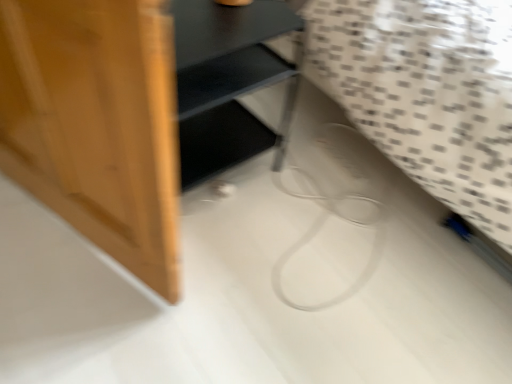
Question: Considering the relative sizes of white textured fabric at lower right and matte black shelf at center in the image provided, is white textured fabric at lower right taller than matte black shelf at center?

Choices:
 (A) yes
 (B) no

Answer: (A)

Question: From a real-world perspective, is white textured fabric at lower right on top of matte black shelf at center?

Choices:
 (A) no
 (B) yes

Answer: (B)

Question: Is matte black shelf at center inside white textured fabric at lower right?

Choices:
 (A) yes
 (B) no

Answer: (B)

Question: From the image's perspective, is white textured fabric at lower right located beneath matte black shelf at center?

Choices:
 (A) no
 (B) yes

Answer: (A)

Question: Can you confirm if white textured fabric at lower right is thinner than matte black shelf at center?

Choices:
 (A) no
 (B) yes

Answer: (A)

Question: From a real-world perspective, is white textured fabric at lower right beneath matte black shelf at center?

Choices:
 (A) no
 (B) yes

Answer: (A)

Question: Is matte black shelf at center oriented away from white textured fabric at lower right?

Choices:
 (A) no
 (B) yes

Answer: (A)

Question: Can you confirm if matte black shelf at center is shorter than white textured fabric at lower right?

Choices:
 (A) no
 (B) yes

Answer: (B)

Question: Is matte black shelf at center positioned behind white textured fabric at lower right?

Choices:
 (A) yes
 (B) no

Answer: (A)

Question: Is white textured fabric at lower right inside matte black shelf at center?

Choices:
 (A) no
 (B) yes

Answer: (A)

Question: Is matte black shelf at center directly adjacent to white textured fabric at lower right?

Choices:
 (A) yes
 (B) no

Answer: (B)

Question: Can you confirm if matte black shelf at center is bigger than white textured fabric at lower right?

Choices:
 (A) yes
 (B) no

Answer: (B)

Question: Is point (232, 105) closer or farther from the camera than point (353, 104)?

Choices:
 (A) closer
 (B) farther

Answer: (B)